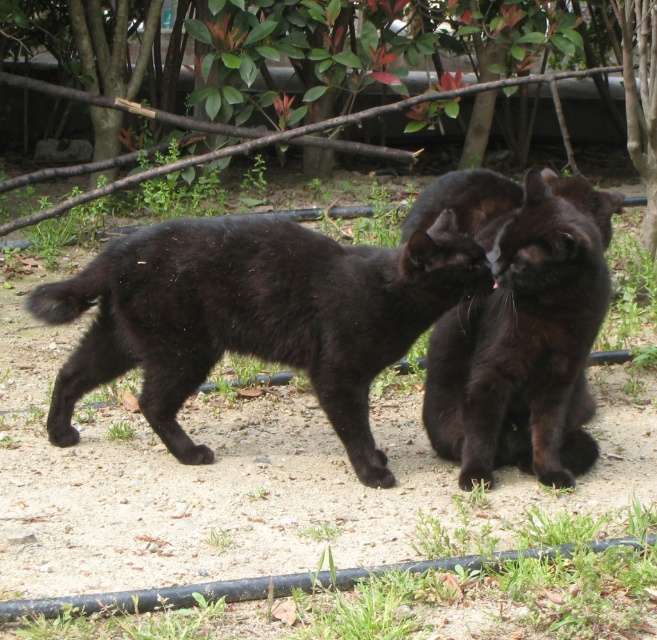
Is matte black cat at center in front of shiny black cat at center?

No, matte black cat at center is further to the viewer.

Does matte black cat at center appear on the right side of shiny black cat at center?

In fact, matte black cat at center is to the left of shiny black cat at center.

Where is `matte black cat at center`? matte black cat at center is located at coordinates (254, 316).

Locate an element on the screen. matte black cat at center is located at coordinates (254, 316).